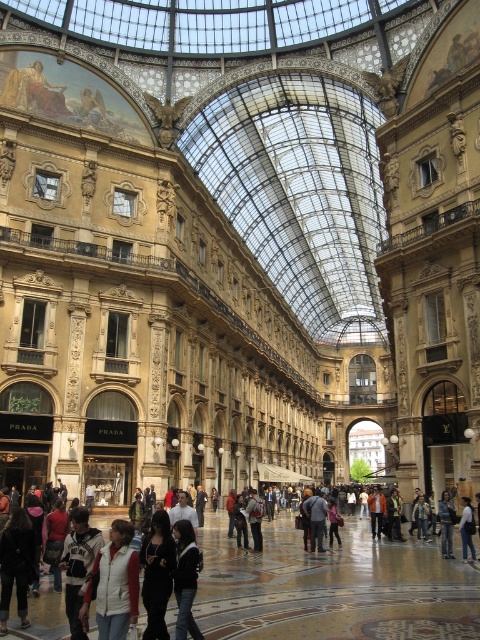
Identify the location of black fabric jacket at center. The height and width of the screenshot is (640, 480). (156, 573).

Where is `black fabric jacket at center`? black fabric jacket at center is located at coordinates (x=156, y=573).

Locate an element on the screen. The height and width of the screenshot is (640, 480). black fabric jacket at center is located at coordinates (156, 573).

Can you confirm if white cotton jacket at center is shorter than black fabric jacket at center?

No.

Is point (247, 625) behind point (159, 516)?

No, (247, 625) is closer to viewer.

You are a GUI agent. You are given a task and a screenshot of the screen. Output one action in this format:
    pyautogui.click(x=<x>, y=<y>)
    Task: Click on the white cotton jacket at center
    This screenshot has width=480, height=640.
    Given the screenshot: What is the action you would take?
    pyautogui.click(x=333, y=588)

Is dark gray sweater at center behind denim jacket at center?

No, dark gray sweater at center is closer to the viewer.

Is point (180, 557) positioned before point (442, 497)?

That is True.

Where is `dark gray sweater at center`? The image size is (480, 640). dark gray sweater at center is located at coordinates (186, 579).